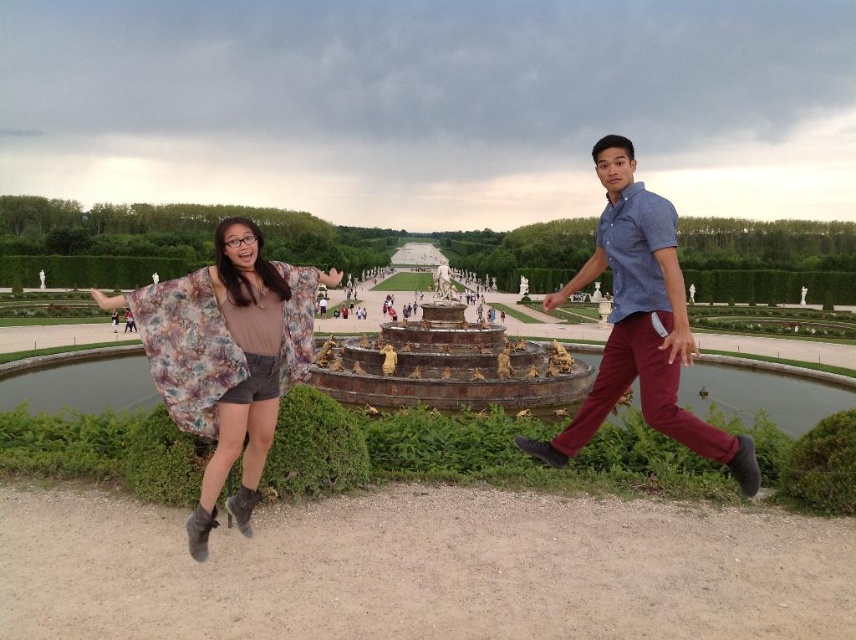
You are standing at the center of the garden and want to find the floral fabric kimono at left. According to the coordinate system where the bottom left corner is the origin, can you determine its location?

The floral fabric kimono at left is located at coordinate point 0.559 on the x axis and 0.266 on the y axis.

You are standing at the point marked as point (447, 365) in the image. Looking around, you see a bronze statue fountain at center. Which direction should you walk to reach the nearest pathway lined with trimmed hedges?

The point (447, 365) is on bronze statue fountain at center, so you should walk towards the pathways lined with trimmed hedges that are located along the edges of the garden. Since the pathways are lined with hedges and the avenue leads into the distance, walking towards the nearest hedge line would depend on the specific layout, but generally, moving towards the edges away from the central fountain area would lead you to the pathways.